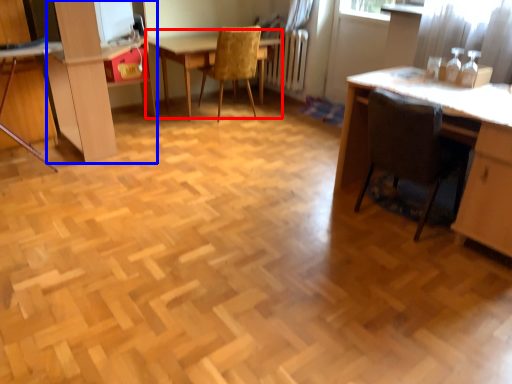
Question: Which of the following is the closest to the observer, table (highlighted by a red box) or dresser (highlighted by a blue box)?

Choices:
 (A) table
 (B) dresser

Answer: (B)